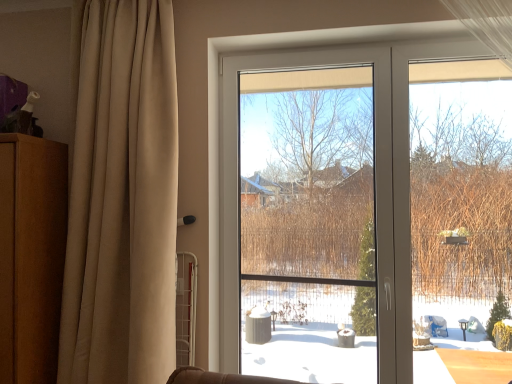
Question: Is brown wood dresser at left oriented towards beige fabric curtain at left?

Choices:
 (A) no
 (B) yes

Answer: (A)

Question: From the image's perspective, is brown wood dresser at left below beige fabric curtain at left?

Choices:
 (A) no
 (B) yes

Answer: (B)

Question: Can you confirm if brown wood dresser at left is positioned to the left of beige fabric curtain at left?

Choices:
 (A) yes
 (B) no

Answer: (A)

Question: Is the position of brown wood dresser at left more distant than that of beige fabric curtain at left?

Choices:
 (A) no
 (B) yes

Answer: (B)

Question: Would you say brown wood dresser at left is a long distance from beige fabric curtain at left?

Choices:
 (A) no
 (B) yes

Answer: (A)

Question: From a real-world perspective, is brown wood dresser at left beneath beige fabric curtain at left?

Choices:
 (A) yes
 (B) no

Answer: (A)

Question: Considering the relative sizes of brown wood dresser at left and transparent plastic window screen at center in the image provided, is brown wood dresser at left smaller than transparent plastic window screen at center?

Choices:
 (A) no
 (B) yes

Answer: (A)

Question: Is brown wood dresser at left shorter than transparent plastic window screen at center?

Choices:
 (A) yes
 (B) no

Answer: (A)

Question: Is brown wood dresser at left positioned with its back to transparent plastic window screen at center?

Choices:
 (A) no
 (B) yes

Answer: (A)

Question: From the image's perspective, does brown wood dresser at left appear lower than transparent plastic window screen at center?

Choices:
 (A) no
 (B) yes

Answer: (B)

Question: From a real-world perspective, is brown wood dresser at left on transparent plastic window screen at center?

Choices:
 (A) no
 (B) yes

Answer: (A)

Question: Is transparent plastic window screen at center inside brown wood dresser at left?

Choices:
 (A) yes
 (B) no

Answer: (B)

Question: Can you confirm if transparent plastic window screen at center is wider than brown wood dresser at left?

Choices:
 (A) no
 (B) yes

Answer: (A)